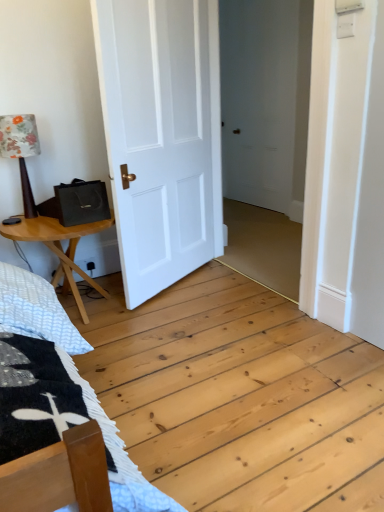
Question: Is wooden table at left smaller than white matte door at center?

Choices:
 (A) yes
 (B) no

Answer: (A)

Question: Can you confirm if wooden table at left is taller than white matte door at center?

Choices:
 (A) no
 (B) yes

Answer: (A)

Question: Does wooden table at left turn towards white matte door at center?

Choices:
 (A) no
 (B) yes

Answer: (A)

Question: Considering the relative positions of wooden table at left and white matte door at center in the image provided, is wooden table at left to the left of white matte door at center from the viewer's perspective?

Choices:
 (A) yes
 (B) no

Answer: (A)

Question: Is wooden table at left bigger than white matte door at center?

Choices:
 (A) yes
 (B) no

Answer: (B)

Question: Relative to white matte door at center, is wooden table at left in front or behind?

Choices:
 (A) front
 (B) behind

Answer: (B)

Question: From their relative heights in the image, would you say wooden table at left is taller or shorter than white matte door at center?

Choices:
 (A) short
 (B) tall

Answer: (A)

Question: Is wooden table at left bigger or smaller than white matte door at center?

Choices:
 (A) small
 (B) big

Answer: (A)

Question: From a real-world perspective, is wooden table at left physically located above or below white matte door at center?

Choices:
 (A) above
 (B) below

Answer: (B)

Question: From the image's perspective, is wooden table at left above or below floral fabric lampshade at left?

Choices:
 (A) above
 (B) below

Answer: (B)

Question: Looking at their shapes, would you say wooden table at left is wider or thinner than floral fabric lampshade at left?

Choices:
 (A) wide
 (B) thin

Answer: (A)

Question: From a real-world perspective, relative to floral fabric lampshade at left, is wooden table at left vertically above or below?

Choices:
 (A) below
 (B) above

Answer: (A)

Question: Is wooden table at left inside or outside of floral fabric lampshade at left?

Choices:
 (A) inside
 (B) outside

Answer: (B)

Question: In the image, is floral fabric lampshade at left on the left side or the right side of white matte door at center?

Choices:
 (A) left
 (B) right

Answer: (A)

Question: From a real-world perspective, is floral fabric lampshade at left physically located above or below white matte door at center?

Choices:
 (A) above
 (B) below

Answer: (B)